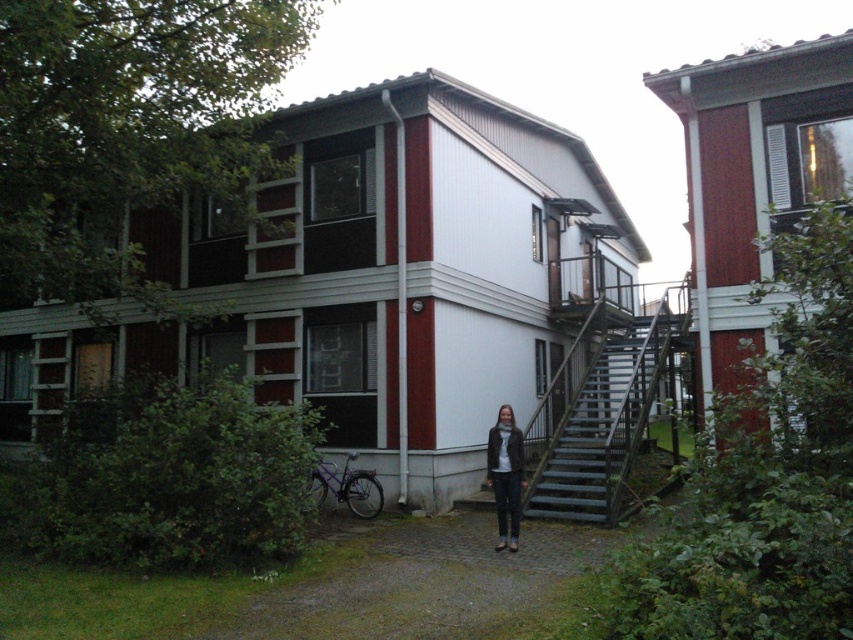
Which is in front, point (585, 362) or point (515, 534)?

Point (515, 534) is in front.

Does metallic gray stairs at center have a greater width compared to leather jacket at center?

In fact, metallic gray stairs at center might be narrower than leather jacket at center.

Is point (555, 460) positioned after point (514, 456)?

Yes.

You are a GUI agent. You are given a task and a screenshot of the screen. Output one action in this format:
    pyautogui.click(x=<x>, y=<y>)
    Task: Click on the metallic gray stairs at center
    The image size is (853, 640).
    Given the screenshot: What is the action you would take?
    pyautogui.click(x=596, y=416)